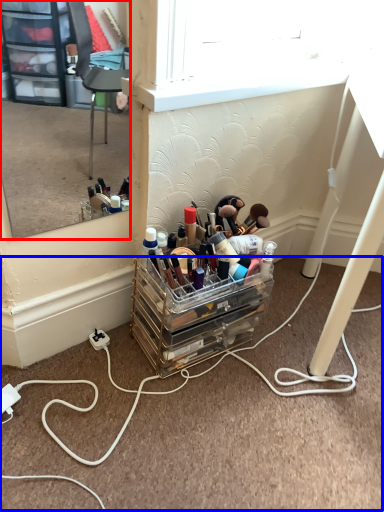
Question: Which object appears farthest to the camera in this image, mirror (highlighted by a red box) or cable (highlighted by a blue box)?

Choices:
 (A) mirror
 (B) cable

Answer: (B)